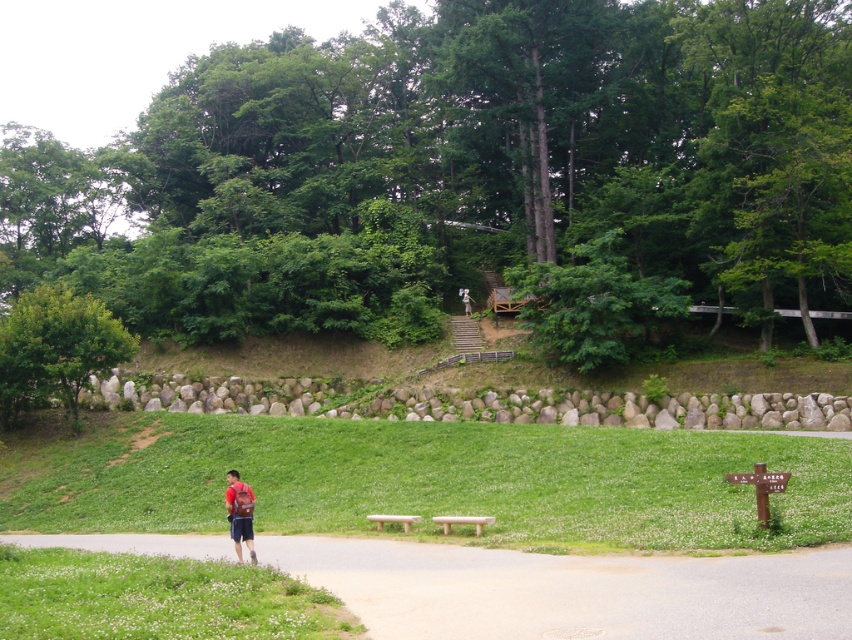
You are a hiker trying to decide which path to take next. You see the gray asphalt path at center and the green grassy at lower left. Which path is wider?

The gray asphalt path at center is wider than the green grassy at lower left according to the description.